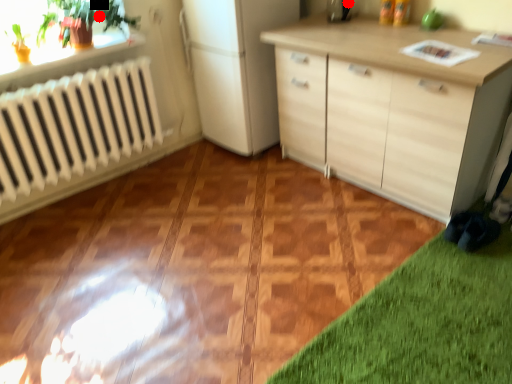
Question: Two points are circled on the image, labeled by A and B beside each circle. Which point is closer to the camera?

Choices:
 (A) A is closer
 (B) B is closer

Answer: (A)